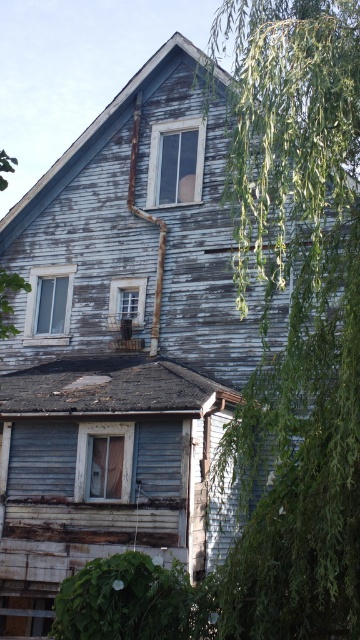
You are a window installer assessing the house. You have two windows to install, one clear glass window at upper center and one matte wood window at center. Based on the house structure, which window should be placed where to match their widths?

The clear glass window at upper center should be placed at the upper center position because it is wider than the matte wood window at center, ensuring proper fit according to the house structure.

You are standing in front of the old house and want to clean both the clear glass window at upper center and the matte wood window at center. Which window should you clean first if you want to start with the one closer to you?

You should clean the clear glass window at upper center first because it is closer to you than the matte wood window at center.

You are standing in front of the old house and notice the green leafy tree at right and the translucent plastic window at center. Which object appears wider from your viewpoint?

The green leafy tree at right appears wider than the translucent plastic window at center because its width surpasses the window.